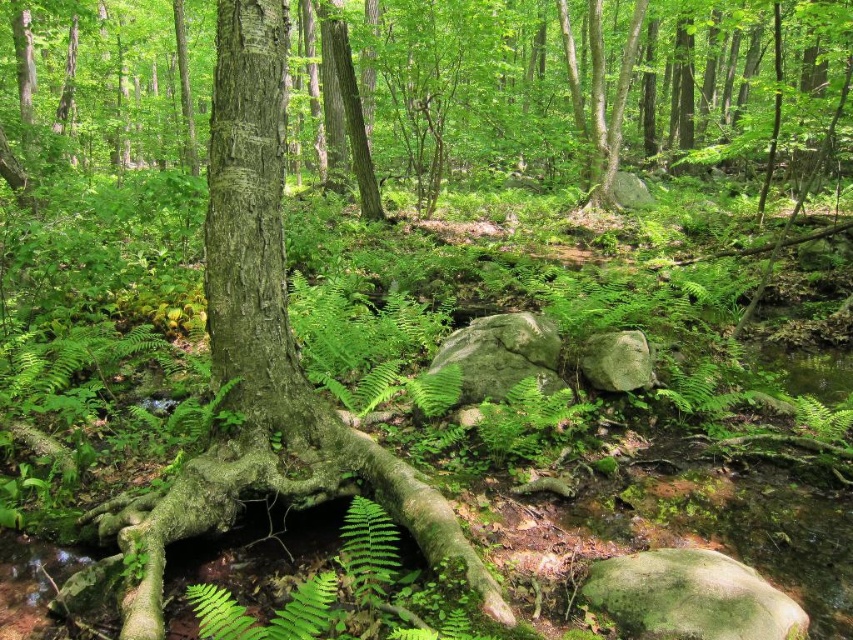
You are standing in the forest scene and want to walk from point A to point B. Point A is at coordinate point (x=540, y=358) and point B is at coordinate point (x=624, y=381). Since you can only move forward, will you reach point B before point A?

Point A at coordinate point (x=540, y=358) is closer to you than point B at coordinate point (x=624, y=381), so you will reach point A before point B.

You are standing at the point labeled point at (544, 364). You want to walk to the nearest tree trunk. How far will you have to walk?

The nearest tree trunk is 4.53 meters away from the point at (544, 364), so you will have to walk 4.53 meters to reach it.

You are a hiker carrying a backpack and want to reach a hidden treasure located behind the green mossy rock at center. The path to the rock is narrow and only allows one person at a time. If you are currently standing 3 meters away from the rock, can you safely walk towards it without any obstacles?

The green mossy rock at center is 4.25 meters from the camera. Since you are currently standing 3 meters away from it, you can safely walk the remaining 1.25 meters to reach it without any obstacles.